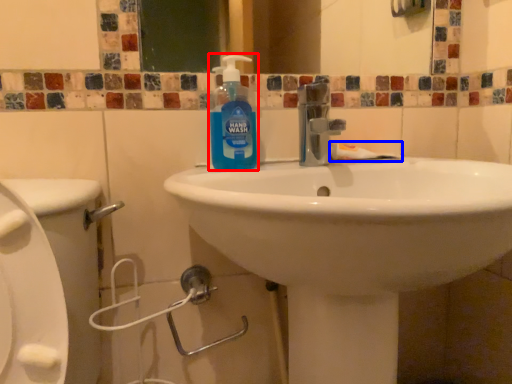
Question: Which object appears closest to the camera in this image, cleaning product (highlighted by a red box) or toothpaste (highlighted by a blue box)?

Choices:
 (A) cleaning product
 (B) toothpaste

Answer: (A)